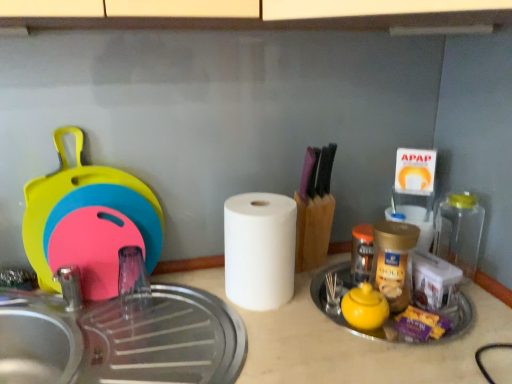
Question: From the image's perspective, is yellow matte teapot at center-right located above or below golden plastic jar at center-right, the second bottle from the left?

Choices:
 (A) below
 (B) above

Answer: (A)

Question: In the image, is yellow matte teapot at center-right positioned in front of or behind golden plastic jar at center-right, the second bottle from the left?

Choices:
 (A) behind
 (B) front

Answer: (B)

Question: Which object is positioned closest to the transparent plastic faucet at left?

Choices:
 (A) white matte paper towel at center, the first paper towel from the right
 (B) white matte paper towel at center, placed as the first paper towel when sorted from left to right
 (C) transparent plastic bottle at right, marked as the 3th bottle in a left-to-right arrangement
 (D) golden plastic jar at center-right, which is the second bottle from right to left
 (E) purple plastic candy at lower right

Answer: (B)

Question: Based on their relative distances, which object is farther from the transparent plastic faucet at left?

Choices:
 (A) golden plastic jar at center-right, the second bottle from the left
 (B) white matte paper towel at center, the 2th paper towel from the left
 (C) purple plastic candy at lower right
 (D) white matte paper towel at center, placed as the first paper towel when sorted from left to right
 (E) transparent plastic bottle at right, positioned as the 1th bottle in right-to-left order

Answer: (E)